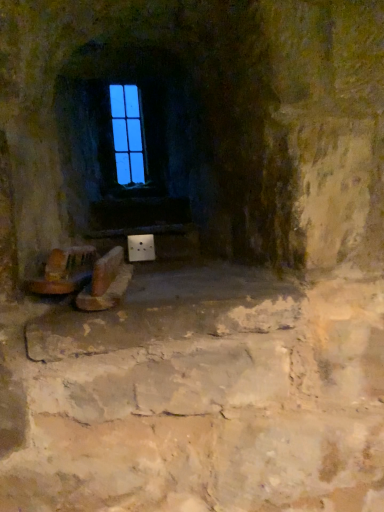
Question: Based on their sizes in the image, would you say brown leather shoes at lower center is bigger or smaller than blue glass window at upper center?

Choices:
 (A) big
 (B) small

Answer: (A)

Question: Considering their positions, is brown leather shoes at lower center located in front of or behind blue glass window at upper center?

Choices:
 (A) behind
 (B) front

Answer: (B)

Question: Estimate the real-world distances between objects in this image. Which object is farther from the wooden chair at lower left?

Choices:
 (A) blue glass window at upper center
 (B) brown leather shoes at lower center

Answer: (A)

Question: Based on their relative distances, which object is nearer to the blue glass window at upper center?

Choices:
 (A) brown leather shoes at lower center
 (B) wooden chair at lower left

Answer: (B)